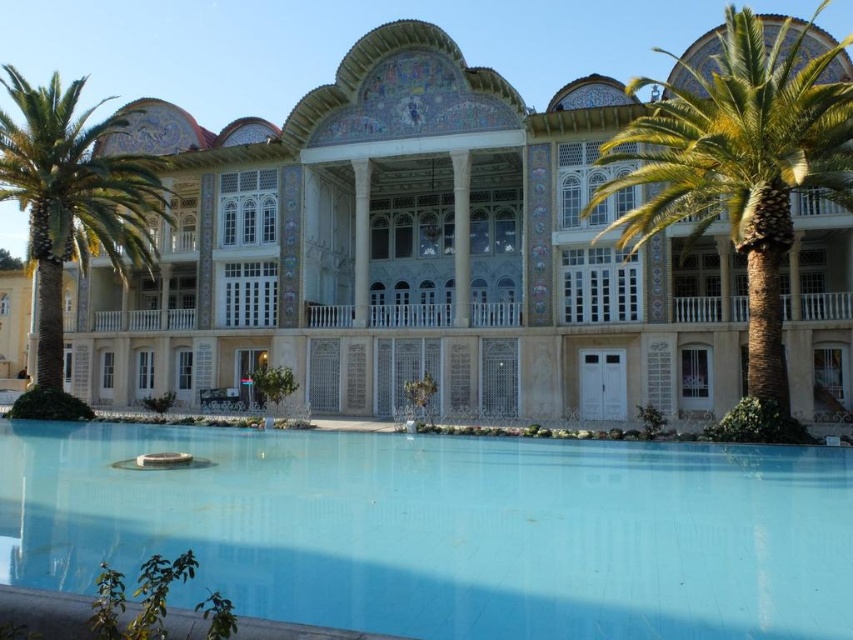
Measure the distance between beige stone building at center and green leafy palm tree at left.

51.28 feet

Can you confirm if beige stone building at center is positioned below green leafy palm tree at left?

Yes.

Between point (317, 248) and point (73, 148), which one is positioned in front?

Positioned in front is point (73, 148).

The image size is (853, 640). I want to click on beige stone building at center, so click(410, 253).

Does beige stone building at center have a greater width compared to green leafy palm tree at right?

Indeed, beige stone building at center has a greater width compared to green leafy palm tree at right.

Is point (509, 209) less distant than point (846, 157)?

No, (509, 209) is behind (846, 157).

The height and width of the screenshot is (640, 853). What are the coordinates of `beige stone building at center` in the screenshot? It's located at [x=410, y=253].

Locate an element on the screen. beige stone building at center is located at coordinates (410, 253).

Is point (433, 364) closer to camera compared to point (689, 609)?

No, (433, 364) is behind (689, 609).

Identify the location of beige stone building at center. The height and width of the screenshot is (640, 853). (410, 253).